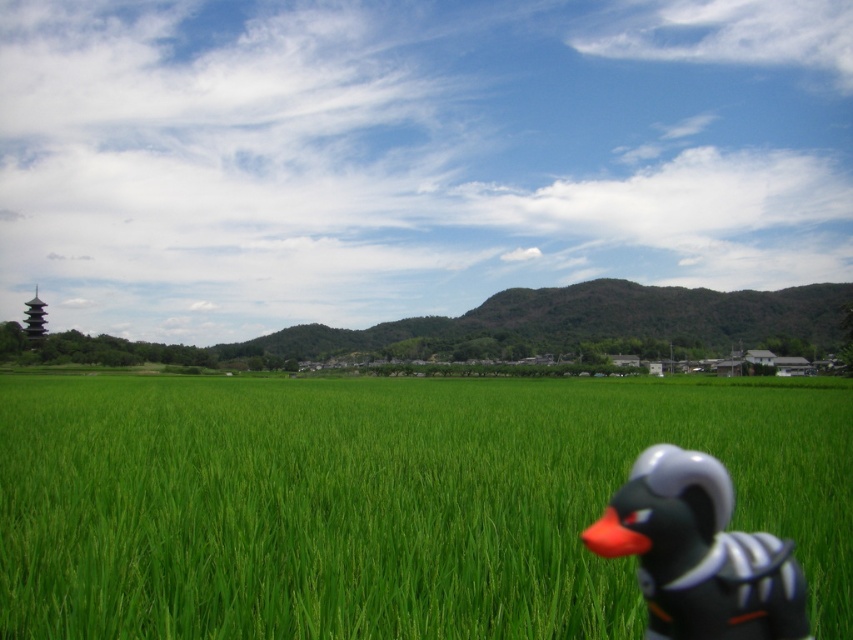
You are a photographer trying to capture the black matte rubber duck at lower right and the green grass at center in a single shot. Which object will appear smaller in the final photo?

The black matte rubber duck at lower right will appear smaller in the final photo because the green grass at center is larger in size than the black matte rubber duck at lower right.

You are standing in the middle of the rice fields and see two points marked in the scene. Which point is closer to you, point (x=213, y=528) or point (x=772, y=614)?

Point (x=213, y=528) is closer to you because it is further to the viewer than point (x=772, y=614).

You are a photographer trying to capture the entire scene of the green grass at center and the black matte rubber duck at lower right in one shot. Based on their sizes in the image, which object would you need to zoom out more to include both fully in the frame?

The green grass at center is wider than the black matte rubber duck at lower right, so you would need to zoom out more to include the wider green grass at center in the frame.